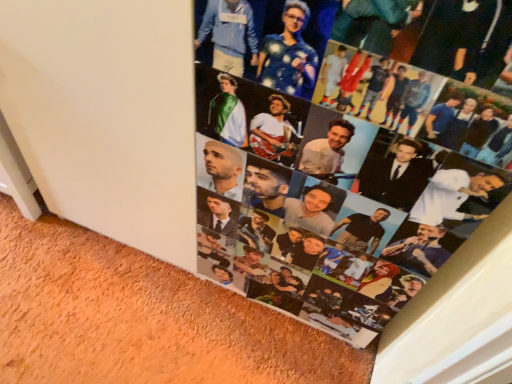
Find the location of `printed photo collage at center`. printed photo collage at center is located at coordinates (340, 186).

The image size is (512, 384). What do you see at coordinates (340, 186) in the screenshot?
I see `printed photo collage at center` at bounding box center [340, 186].

The width and height of the screenshot is (512, 384). Find the location of `printed photo collage at center`. printed photo collage at center is located at coordinates (340, 186).